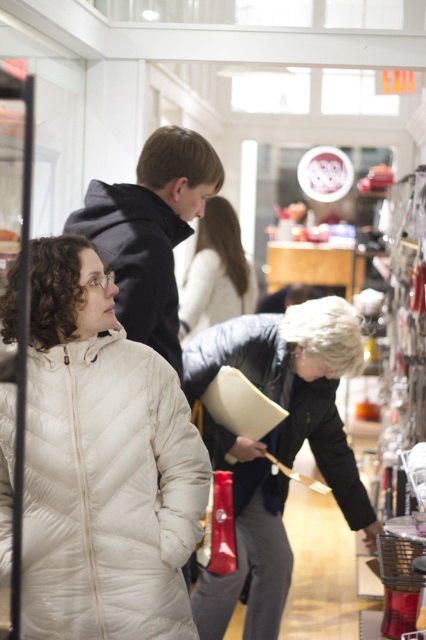
Question: Which point is closer to the camera?

Choices:
 (A) (222, 326)
 (B) (204, 257)

Answer: (A)

Question: Is white puffer coat at center bigger than white puffer coat at left?

Choices:
 (A) no
 (B) yes

Answer: (A)

Question: Among these points, which one is farthest from the camera?

Choices:
 (A) (241, 333)
 (B) (5, 497)

Answer: (A)

Question: Which is farther from the white puffer coat at left?

Choices:
 (A) white puffer coat at center
 (B) black quilted coat at center
 (C) white quilted jacket at center

Answer: (C)

Question: Does white puffer coat at center have a larger size compared to white quilted jacket at center?

Choices:
 (A) no
 (B) yes

Answer: (A)

Question: Is black quilted coat at center to the right of white puffer coat at left from the viewer's perspective?

Choices:
 (A) no
 (B) yes

Answer: (B)